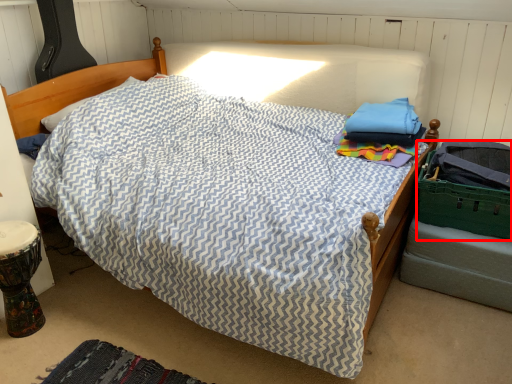
Question: Observing the image, what is the correct spatial positioning of laundry basket (annotated by the red box) in reference to mat?

Choices:
 (A) left
 (B) right

Answer: (B)